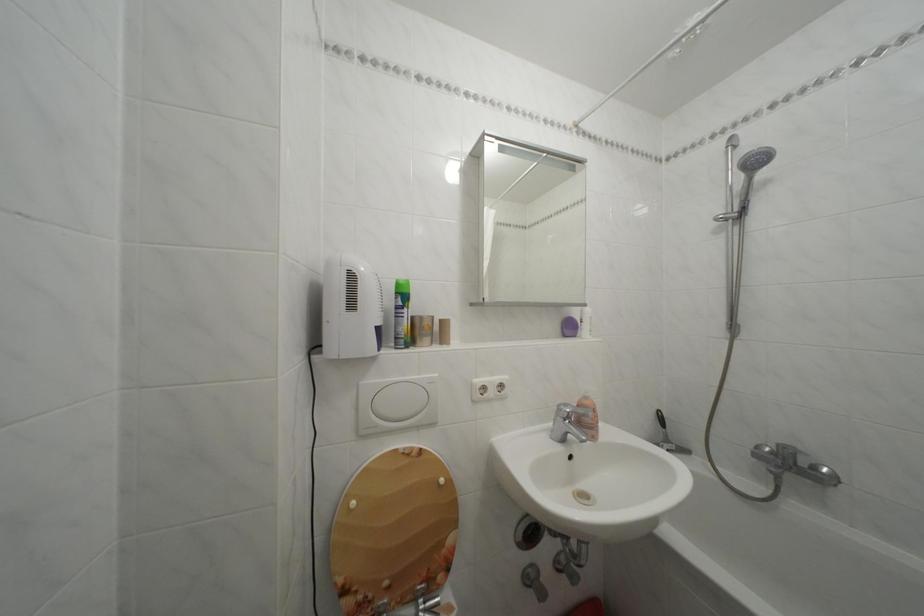
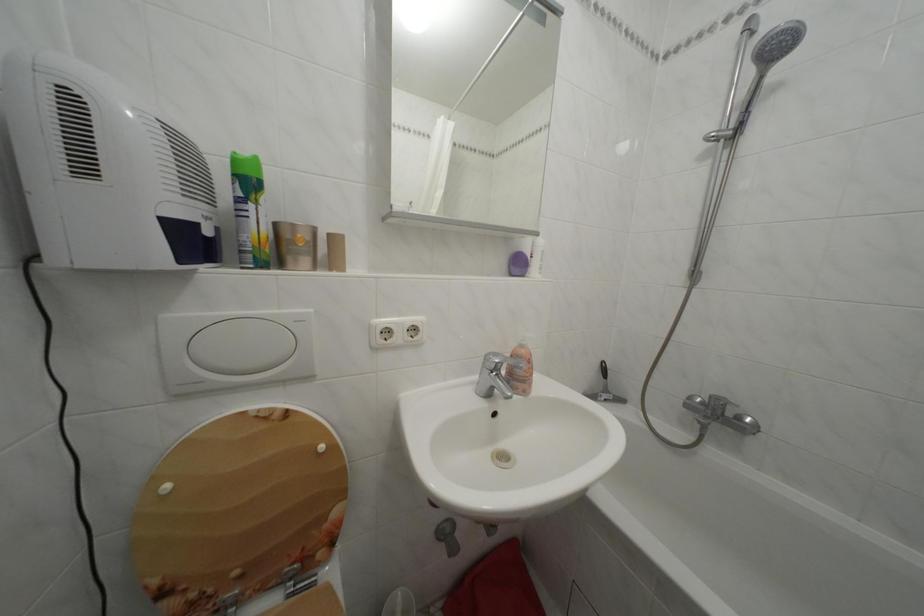
Find the pixel in the second image that matches the point at 675,447 in the first image.

(614, 397)